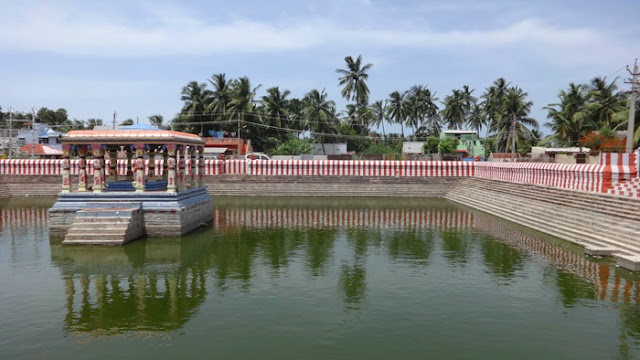
Where is `pillar`? The width and height of the screenshot is (640, 360). pillar is located at coordinates (189, 181).